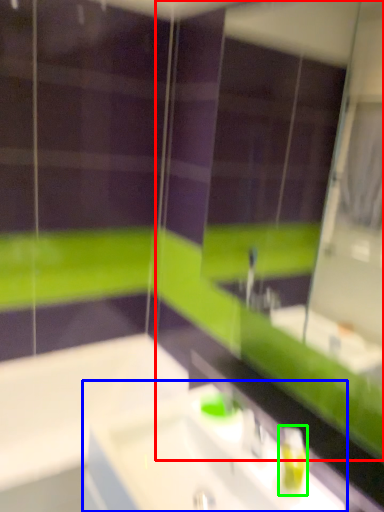
Question: Which object is positioned closest to mirror (highlighted by a red box)? Select from sink (highlighted by a blue box) and soap dispenser (highlighted by a green box).

Choices:
 (A) sink
 (B) soap dispenser

Answer: (A)